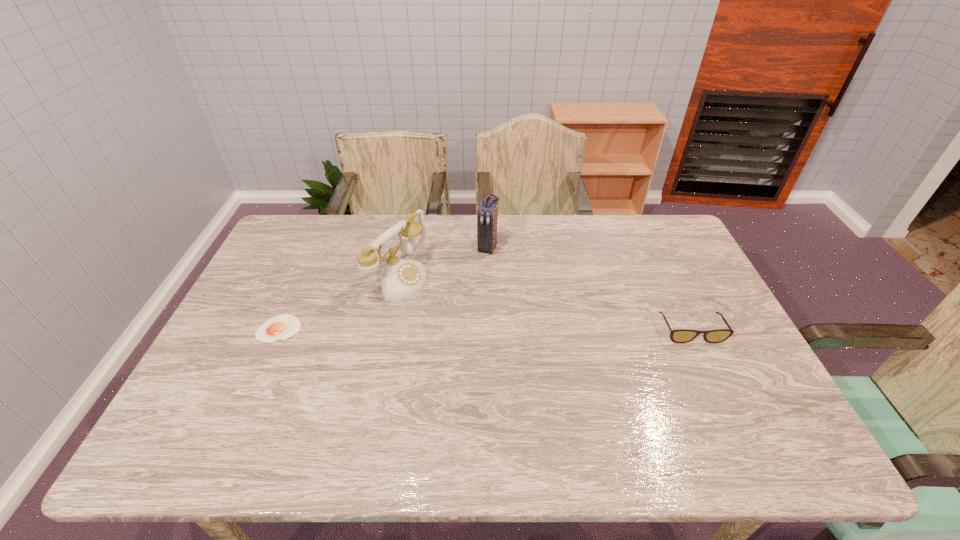
The image size is (960, 540). Find the location of `vacant space located with the zip open on the clutch bag`. vacant space located with the zip open on the clutch bag is located at coordinates (454, 314).

Locate an element on the screen. free space located 0.300m on the dial of the second object from left to right is located at coordinates (509, 330).

What are the coordinates of `free space located 0.260m on the dial of the second object from left to right` in the screenshot? It's located at (496, 325).

Identify the location of free point located 0.280m on the dial of the second object from left to right. (502, 327).

The height and width of the screenshot is (540, 960). I want to click on clutch bag that is at the far edge, so click(x=487, y=213).

You are a GUI agent. You are given a task and a screenshot of the screen. Output one action in this format:
    pyautogui.click(x=<x>, y=<y>)
    Task: Click on the telephone at the far edge
    Image resolution: width=960 pixels, height=540 pixels.
    Given the screenshot: What is the action you would take?
    pyautogui.click(x=401, y=278)

Where is `object at the left edge`? The width and height of the screenshot is (960, 540). object at the left edge is located at coordinates (281, 327).

In order to click on object that is positioned at the right edge in this screenshot , I will do `click(678, 335)`.

This screenshot has height=540, width=960. Find the location of `free space at the far edge`. free space at the far edge is located at coordinates (578, 243).

The width and height of the screenshot is (960, 540). In the image, there is a desktop. In order to click on free space at the near edge in this screenshot , I will do `click(566, 399)`.